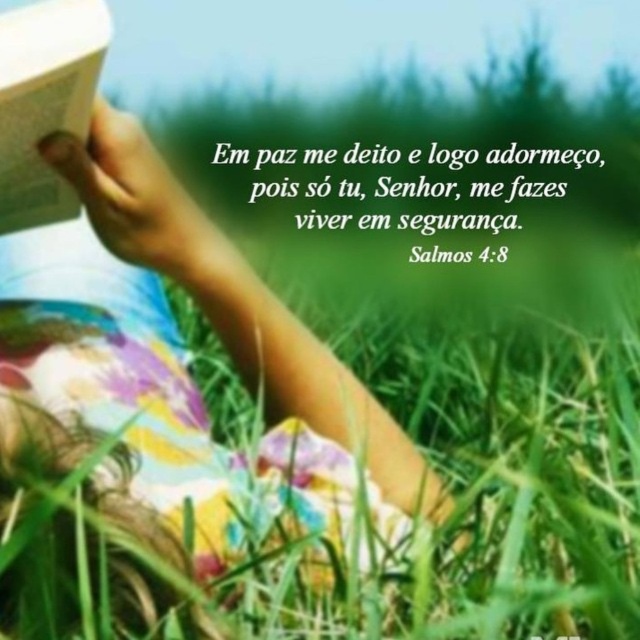
Question: Can you confirm if green leafy text at center is smaller than white paper book at upper left?

Choices:
 (A) no
 (B) yes

Answer: (A)

Question: Is green leafy text at center above white paper book at upper left?

Choices:
 (A) no
 (B) yes

Answer: (B)

Question: Which of the following is the farthest from the observer?

Choices:
 (A) (54, 220)
 (B) (168, 317)
 (C) (570, 166)

Answer: (C)

Question: Which object is positioned farthest from the green leafy text at center?

Choices:
 (A) pastel floral dress at center
 (B) white paper book at upper left

Answer: (B)

Question: Is pastel floral dress at center to the left of white paper book at upper left from the viewer's perspective?

Choices:
 (A) yes
 (B) no

Answer: (B)

Question: Which point is farther to the camera?

Choices:
 (A) click(x=278, y=237)
 (B) click(x=364, y=435)
 (C) click(x=16, y=45)

Answer: (A)